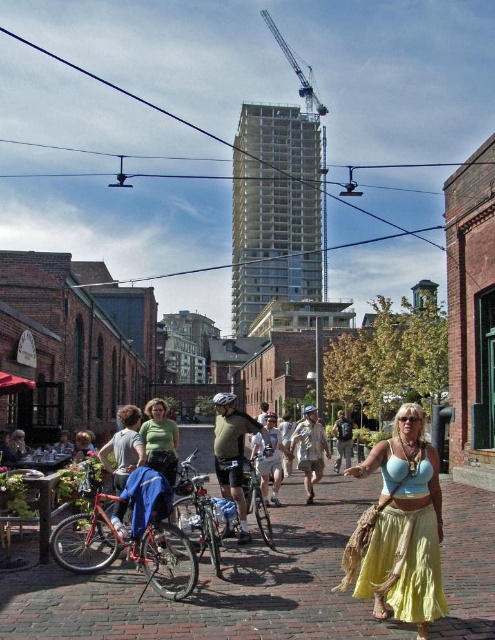
Question: Does light yellow cotton skirt at lower right come behind khaki cotton shorts at center?

Choices:
 (A) no
 (B) yes

Answer: (A)

Question: Which of the following is the closest to the observer?

Choices:
 (A) (340, 426)
 (B) (305, 481)
 (C) (239, 490)
 (D) (153, 429)

Answer: (C)

Question: In this image, where is brick pavement at center located relative to light yellow cotton skirt at lower right?

Choices:
 (A) left
 (B) right

Answer: (A)

Question: In this image, where is brick pavement at center located relative to khaki cotton shorts at center?

Choices:
 (A) left
 (B) right

Answer: (A)

Question: Among these objects, which one is farthest from the camera?

Choices:
 (A) matte green helmet at center
 (B) light brown leather jacket at center

Answer: (B)

Question: Estimate the real-world distances between objects in this image. Which object is farther from the light brown leather jacket at center?

Choices:
 (A) khaki cotton shorts at center
 (B) green cotton shirt at center
 (C) brick pavement at center
 (D) matte green helmet at center

Answer: (C)